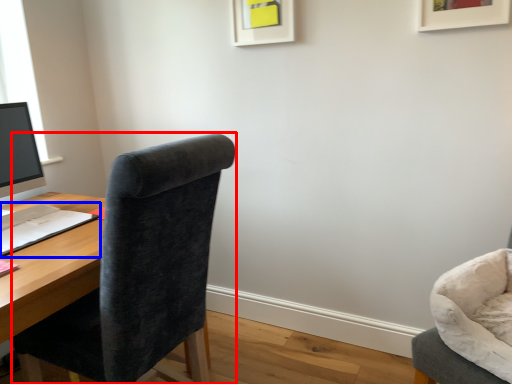
Question: Which object is further to the camera taking this photo, chair (highlighted by a red box) or notepad (highlighted by a blue box)?

Choices:
 (A) chair
 (B) notepad

Answer: (B)